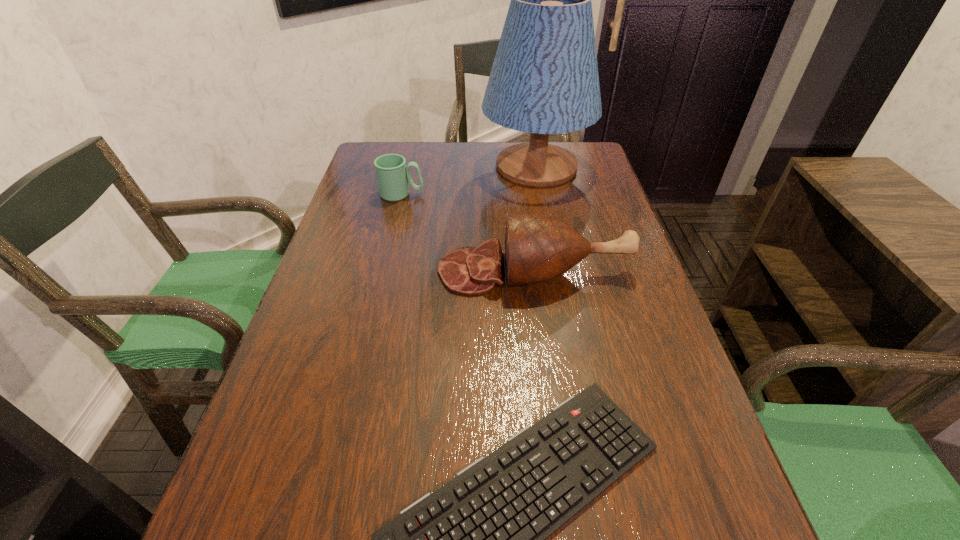
Find the location of a particular element. The image size is (960, 540). object that is at the far edge is located at coordinates (544, 80).

You are a GUI agent. You are given a task and a screenshot of the screen. Output one action in this format:
    pyautogui.click(x=<x>, y=<y>)
    Task: Click on the object that is at the left edge
    The width and height of the screenshot is (960, 540).
    Given the screenshot: What is the action you would take?
    pyautogui.click(x=393, y=176)

The width and height of the screenshot is (960, 540). Find the location of `lampshade at the right edge`. lampshade at the right edge is located at coordinates (544, 80).

You are a GUI agent. You are given a task and a screenshot of the screen. Output one action in this format:
    pyautogui.click(x=<x>, y=<y>)
    Task: Click on the ham that is at the right edge
    
    Given the screenshot: What is the action you would take?
    pyautogui.click(x=538, y=248)

This screenshot has height=540, width=960. What are the coordinates of `object that is at the far right corner` in the screenshot? It's located at (544, 80).

Locate an element on the screen. The width and height of the screenshot is (960, 540). vacant space at the far edge of the desktop is located at coordinates (429, 159).

In the image, there is a desktop. At what (x,y) coordinates should I click in order to perform the action: click on vacant space at the left edge. Please return your answer as a coordinate pair (x, y). The height and width of the screenshot is (540, 960). Looking at the image, I should click on (367, 354).

Identify the location of free space at the right edge of the desktop. (612, 260).

In the image, there is a desktop. Where is `vacant space at the far right corner`? This screenshot has height=540, width=960. vacant space at the far right corner is located at coordinates (588, 146).

This screenshot has width=960, height=540. In order to click on free space between the mug and the third shortest object in this screenshot , I will do `click(468, 232)`.